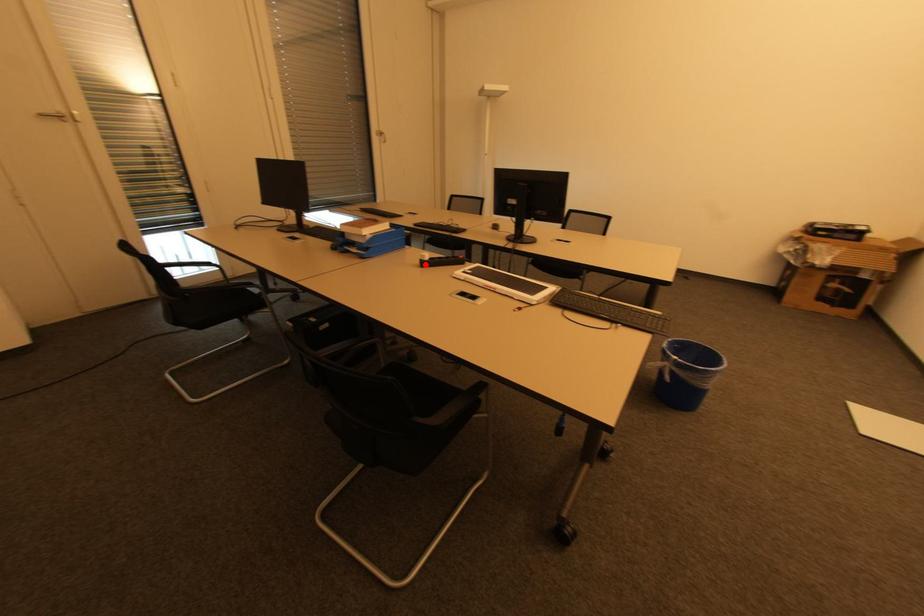
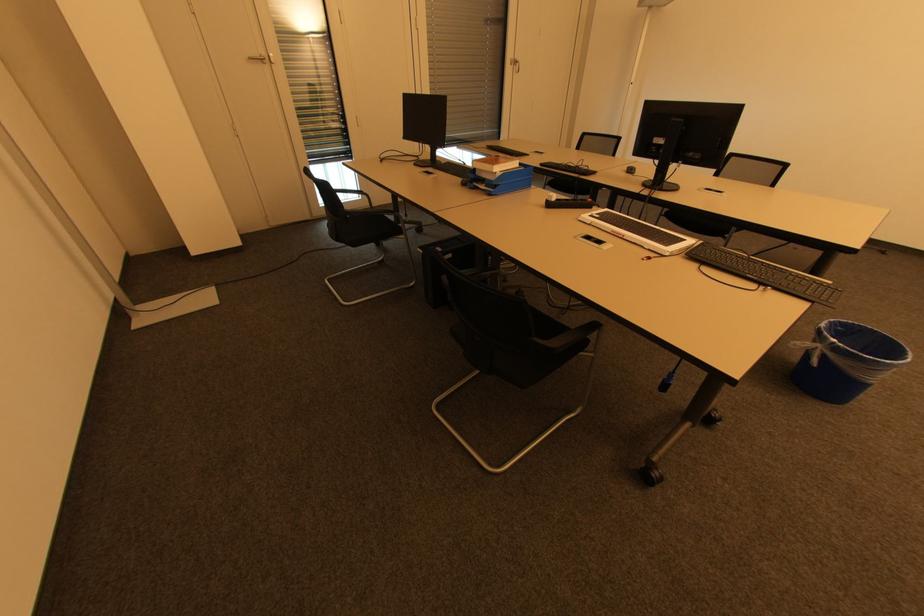
Where in the second image is the point corresponding to the highlighted location from the first image?

(551, 206)